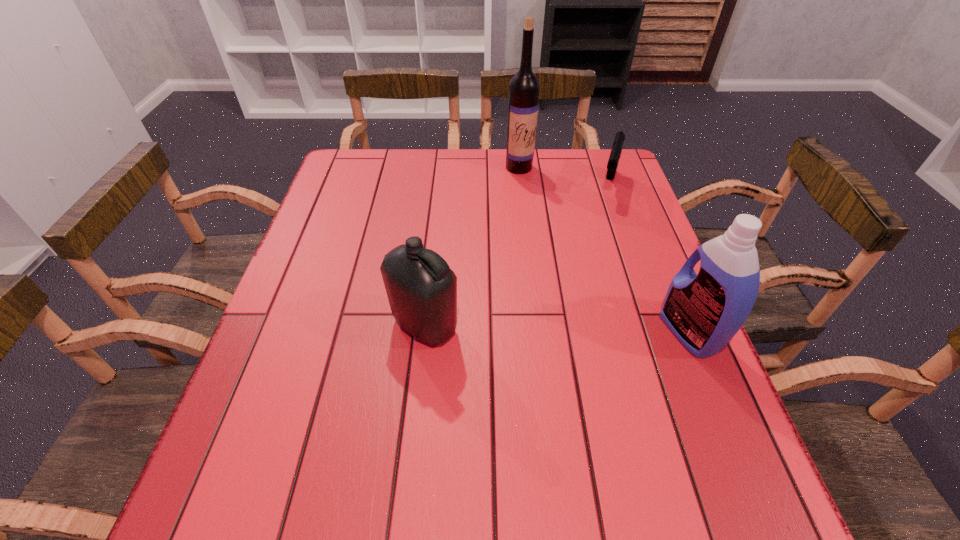
Where is `bottle`? Image resolution: width=960 pixels, height=540 pixels. bottle is located at coordinates (422, 289).

At what (x,y) coordinates should I click in order to perform the action: click on the second shortest object. Please return your answer as a coordinate pair (x, y). This screenshot has height=540, width=960. Looking at the image, I should click on (422, 289).

Locate an element on the screen. This screenshot has width=960, height=540. the third shortest object is located at coordinates (705, 311).

Locate an element on the screen. This screenshot has width=960, height=540. wine bottle is located at coordinates (524, 87).

The height and width of the screenshot is (540, 960). I want to click on the tallest object, so click(524, 87).

Find the location of `the shortest object`. the shortest object is located at coordinates pyautogui.click(x=616, y=151).

Where is `free region located on the back of the bottle`? This screenshot has width=960, height=540. free region located on the back of the bottle is located at coordinates (430, 278).

Locate an element on the screen. free space located 0.060m on the left of the third shortest object is located at coordinates (636, 332).

Locate an element on the screen. free space located 0.140m on the label of the wine bottle is located at coordinates (533, 202).

Locate an element on the screen. Image resolution: width=960 pixels, height=540 pixels. vacant space positioned 0.260m on the label of the wine bottle is located at coordinates (543, 228).